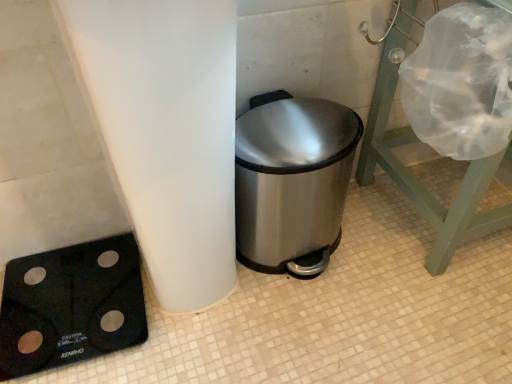
Where is `transparent plastic shower cap at upper right`? This screenshot has height=384, width=512. transparent plastic shower cap at upper right is located at coordinates (414, 175).

Image resolution: width=512 pixels, height=384 pixels. I want to click on black rubberized scale at lower left, so click(x=72, y=305).

What's the angular difference between transparent plastic shower cap at upper right and stainless steel trash can at center's facing directions?

The angular difference between transparent plastic shower cap at upper right and stainless steel trash can at center is 94.4 degrees.

Is transparent plastic shower cap at upper right oriented away from stainless steel trash can at center?

transparent plastic shower cap at upper right is not turned away from stainless steel trash can at center.

Does transparent plastic shower cap at upper right appear on the right side of stainless steel trash can at center?

Yes.

Which is behind, point (408, 41) or point (293, 223)?

The point (408, 41) is farther from the camera.

Is stainless steel trash can at center shorter than black rubberized scale at lower left?

Incorrect, the height of stainless steel trash can at center does not fall short of that of black rubberized scale at lower left.

Between stainless steel trash can at center and black rubberized scale at lower left, which one has smaller width?

With smaller width is stainless steel trash can at center.

From a real-world perspective, relative to black rubberized scale at lower left, is stainless steel trash can at center vertically above or below?

Clearly, from a real-world perspective, stainless steel trash can at center is above black rubberized scale at lower left.

Does black rubberized scale at lower left have a larger size compared to stainless steel trash can at center?

No.

Image resolution: width=512 pixels, height=384 pixels. I want to click on weight scale on the left of stainless steel trash can at center, so click(x=72, y=305).

Considering the sizes of black rubberized scale at lower left and stainless steel trash can at center in the image, is black rubberized scale at lower left taller or shorter than stainless steel trash can at center?

Considering their sizes, black rubberized scale at lower left has less height than stainless steel trash can at center.

In the scene shown: Is black rubberized scale at lower left behind transparent plastic shower cap at upper right?

Yes, black rubberized scale at lower left is further from the viewer.

Is black rubberized scale at lower left looking in the opposite direction of transparent plastic shower cap at upper right?

black rubberized scale at lower left is not turned away from transparent plastic shower cap at upper right.

From a real-world perspective, is black rubberized scale at lower left positioned over transparent plastic shower cap at upper right based on gravity?

No, from a real-world perspective, black rubberized scale at lower left is not above transparent plastic shower cap at upper right.

Does black rubberized scale at lower left have a larger size compared to transparent plastic shower cap at upper right?

No.

How distant is stainless steel trash can at center from transparent plastic shower cap at upper right?

stainless steel trash can at center and transparent plastic shower cap at upper right are 10.35 inches apart from each other.

In terms of width, does stainless steel trash can at center look wider or thinner when compared to transparent plastic shower cap at upper right?

In the image, stainless steel trash can at center appears to be more narrow than transparent plastic shower cap at upper right.

Does stainless steel trash can at center lie behind transparent plastic shower cap at upper right?

Yes, stainless steel trash can at center is further from the camera.

Is stainless steel trash can at center taller or shorter than transparent plastic shower cap at upper right?

Clearly, stainless steel trash can at center is shorter compared to transparent plastic shower cap at upper right.

Considering the positions of point (466, 219) and point (40, 292), is point (466, 219) closer or farther from the camera than point (40, 292)?

Point (466, 219) is closer to the camera than point (40, 292).

How many degrees apart are the facing directions of transparent plastic shower cap at upper right and black rubberized scale at lower left?

There is a 89.7-degree angle between the facing directions of transparent plastic shower cap at upper right and black rubberized scale at lower left.

Would you say transparent plastic shower cap at upper right is to the left or to the right of black rubberized scale at lower left in the picture?

Based on their positions, transparent plastic shower cap at upper right is located to the right of black rubberized scale at lower left.

From a real-world perspective, does transparent plastic shower cap at upper right sit lower than black rubberized scale at lower left?

No, from a real-world perspective, transparent plastic shower cap at upper right is not beneath black rubberized scale at lower left.

The image size is (512, 384). Find the location of `waste container that appears behind the transparent plastic shower cap at upper right`. waste container that appears behind the transparent plastic shower cap at upper right is located at coordinates (292, 182).

Image resolution: width=512 pixels, height=384 pixels. Identify the location of waste container lying in front of the black rubberized scale at lower left. pos(292,182).

When comparing their distances from black rubberized scale at lower left, does stainless steel trash can at center or transparent plastic shower cap at upper right seem further?

transparent plastic shower cap at upper right lies further to black rubberized scale at lower left than the other object.

Which object lies nearer to the anchor point transparent plastic shower cap at upper right, black rubberized scale at lower left or stainless steel trash can at center?

stainless steel trash can at center is closer to transparent plastic shower cap at upper right.

Based on their spatial positions, is stainless steel trash can at center or black rubberized scale at lower left further from transparent plastic shower cap at upper right?

Based on the image, black rubberized scale at lower left appears to be further to transparent plastic shower cap at upper right.

Which object lies further to the anchor point stainless steel trash can at center, black rubberized scale at lower left or transparent plastic shower cap at upper right?

black rubberized scale at lower left lies further to stainless steel trash can at center than the other object.

Estimate the real-world distances between objects in this image. Which object is further from black rubberized scale at lower left, transparent plastic shower cap at upper right or stainless steel trash can at center?

transparent plastic shower cap at upper right is further to black rubberized scale at lower left.

From the image, which object appears to be nearer to stainless steel trash can at center, transparent plastic shower cap at upper right or black rubberized scale at lower left?

Among the two, transparent plastic shower cap at upper right is located nearer to stainless steel trash can at center.

You are a GUI agent. You are given a task and a screenshot of the screen. Output one action in this format:
    pyautogui.click(x=<x>, y=<y>)
    Task: Click on the waste container between black rubberized scale at lower left and transparent plastic shower cap at upper right in the horizontal direction
    The width and height of the screenshot is (512, 384).
    Given the screenshot: What is the action you would take?
    pyautogui.click(x=292, y=182)